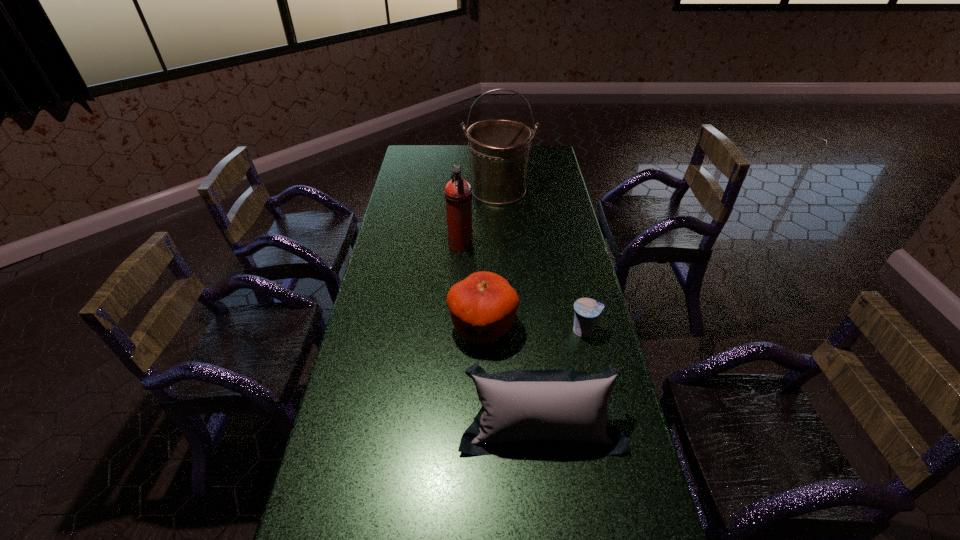
Image resolution: width=960 pixels, height=540 pixels. Identify the location of the farthest object. (499, 149).

Identify the location of bucket. (499, 149).

Locate an element on the screen. fire extinguisher is located at coordinates coord(458,192).

At what (x,y) coordinates should I click in order to perform the action: click on the fourth nearest object. Please return your answer as a coordinate pair (x, y). This screenshot has height=540, width=960. Looking at the image, I should click on (458, 192).

Find the location of a particular element. The width and height of the screenshot is (960, 540). pumpkin is located at coordinates (483, 306).

The height and width of the screenshot is (540, 960). In order to click on the nearest object in this screenshot , I will do `click(565, 410)`.

Where is `the second shortest object`? This screenshot has width=960, height=540. the second shortest object is located at coordinates (565, 410).

Where is `the shortest object`? This screenshot has width=960, height=540. the shortest object is located at coordinates pyautogui.click(x=587, y=310).

Where is `vacant space located 0.050m on the back of the farthest object`? The image size is (960, 540). vacant space located 0.050m on the back of the farthest object is located at coordinates (497, 171).

At what (x,y) coordinates should I click in order to perform the action: click on free region located 0.270m at the nozzle of the second farthest object. Please return your answer as a coordinate pair (x, y). Image resolution: width=960 pixels, height=540 pixels. Looking at the image, I should click on tap(540, 246).